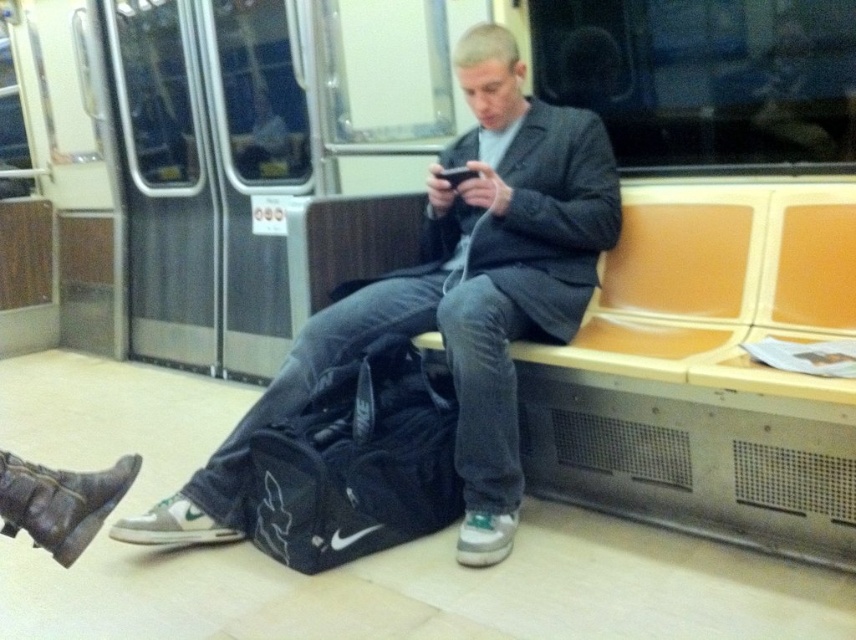
You are a passenger on a subway car and need to locate your metallic silver train at center and matte black jacket at center. According to the scene, which object is positioned to the left?

The metallic silver train at center is to the left of the matte black jacket at center.

What object is located at the coordinate point [348,141] in the subway car scene?

The metallic silver train at center is located at the coordinate point [348,141].